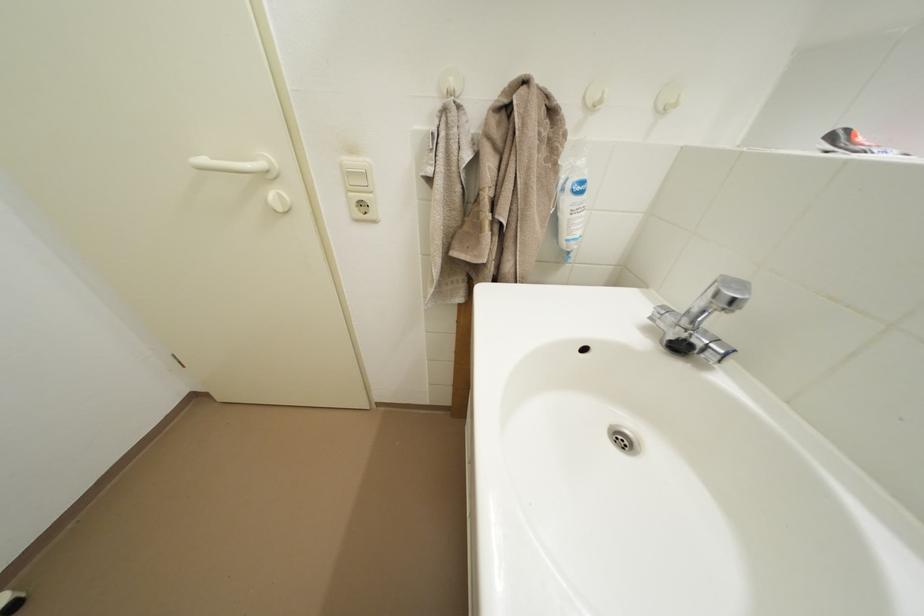
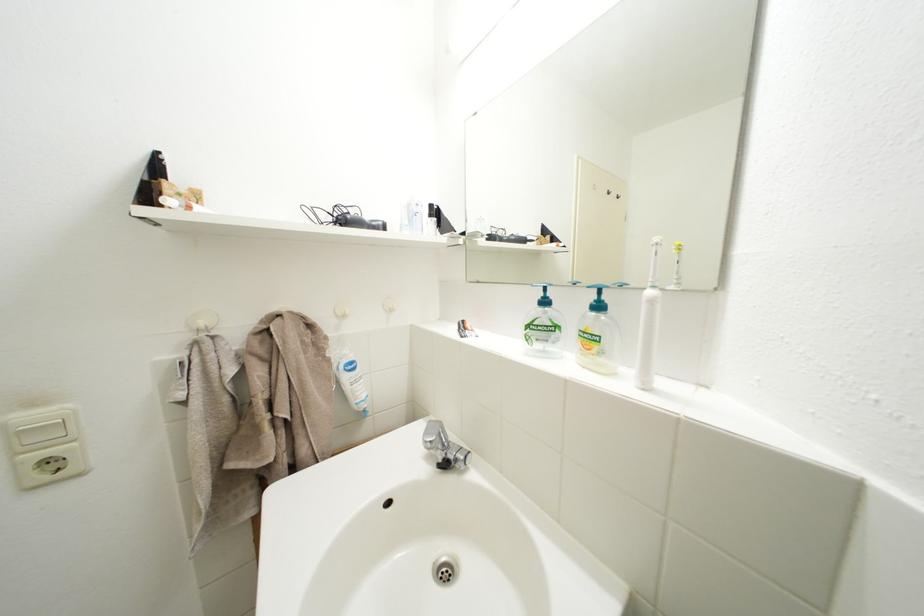
In the second image, find the point that corresponds to (x=350, y=172) in the first image.

(14, 432)